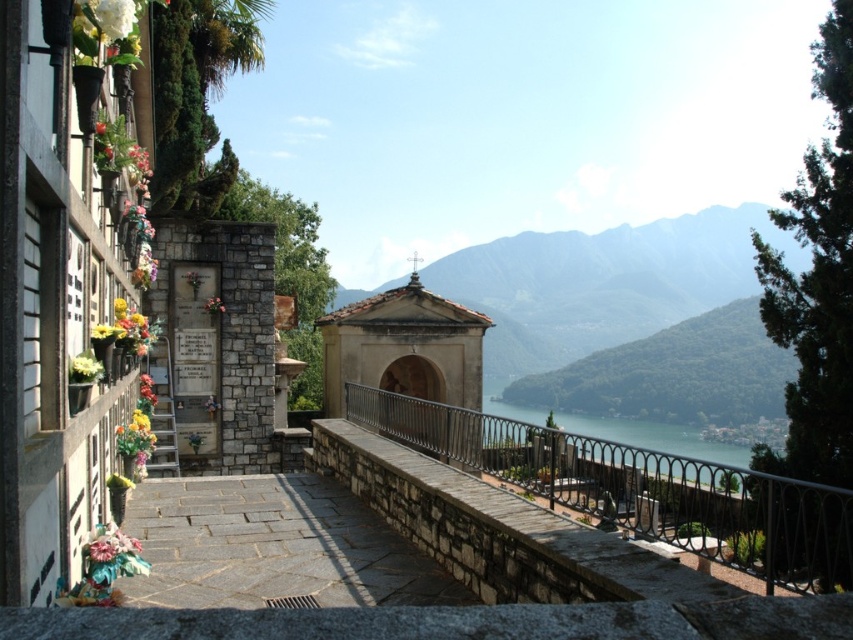
Who is taller, black wrought iron railing at center or gray stone path at center?

black wrought iron railing at center

Is black wrought iron railing at center bigger than gray stone path at center?

Indeed, black wrought iron railing at center has a larger size compared to gray stone path at center.

Who is more distant from viewer, (743, 490) or (413, 589)?

Positioned behind is point (413, 589).

Where is `black wrought iron railing at center`? Image resolution: width=853 pixels, height=640 pixels. black wrought iron railing at center is located at coordinates (637, 488).

Who is shorter, green textured mountain at center or gray stone path at center?

With less height is gray stone path at center.

Does point (515, 310) come farther from viewer compared to point (306, 561)?

Yes, point (515, 310) is behind point (306, 561).

Between point (695, 301) and point (161, 570), which one is positioned behind?

The point (695, 301) is more distant.

You are a GUI agent. You are given a task and a screenshot of the screen. Output one action in this format:
    pyautogui.click(x=<x>, y=<y>)
    Task: Click on the green textured mountain at center
    
    Given the screenshot: What is the action you would take?
    pyautogui.click(x=602, y=284)

From the picture: Who is positioned more to the left, gray stone path at center or greenish-blue water at center?

From the viewer's perspective, gray stone path at center appears more on the left side.

Who is more distant from viewer, [376,515] or [490,400]?

Point [490,400]

What do you see at coordinates (273, 547) in the screenshot? I see `gray stone path at center` at bounding box center [273, 547].

Find the location of a particular element. The image size is (853, 640). gray stone path at center is located at coordinates (273, 547).